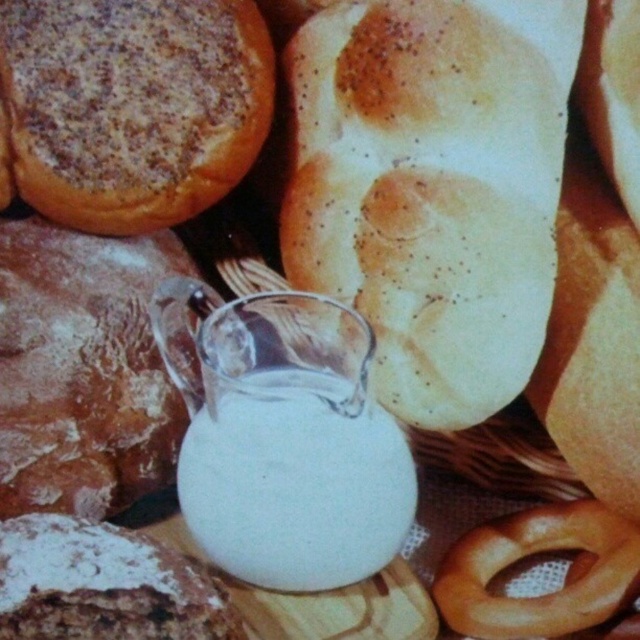
Question: Can you confirm if golden crusty bread at center is positioned above white opaque jug at center?

Choices:
 (A) yes
 (B) no

Answer: (A)

Question: Observing the image, what is the correct spatial positioning of white floury bread at center in reference to white opaque jug at center?

Choices:
 (A) above
 (B) below

Answer: (A)

Question: Is cinnamon-sugar bun at upper left closer to camera compared to white opaque jug at center?

Choices:
 (A) yes
 (B) no

Answer: (B)

Question: Which of these objects is positioned farthest from the white opaque jug at center?

Choices:
 (A) powdery white cake at lower left
 (B) white floury bread at center

Answer: (B)

Question: Estimate the real-world distances between objects in this image. Which object is closer to the powdery white cake at lower left?

Choices:
 (A) cinnamon-sugar bun at upper left
 (B) white floury bread at center
 (C) white opaque jug at center

Answer: (C)

Question: Which point is closer to the camera?

Choices:
 (A) (106, 536)
 (B) (600, 572)
 (C) (353, 3)
 (D) (196, 269)

Answer: (A)